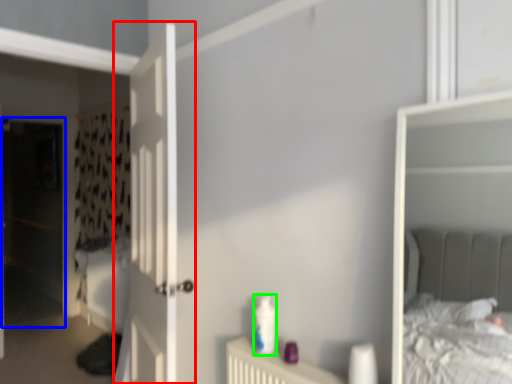
Question: Considering the real-world distances, which object is farthest from door (highlighted by a red box)? screen door (highlighted by a blue box) or toiletry (highlighted by a green box)?

Choices:
 (A) screen door
 (B) toiletry

Answer: (A)